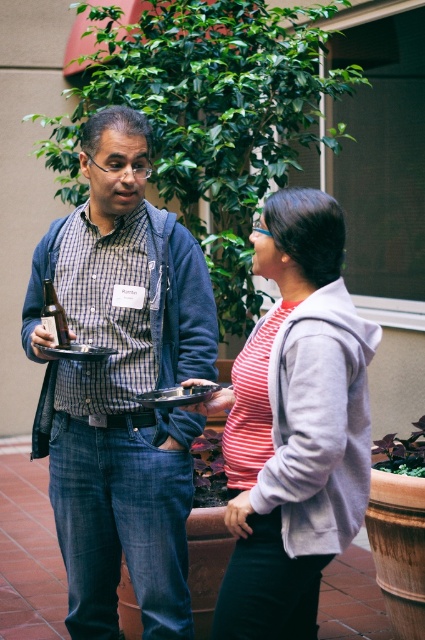
Question: Which point appears farthest from the camera in this image?

Choices:
 (A) (81, 145)
 (B) (252, 406)

Answer: (A)

Question: Does matte blue jeans at center lie in front of striped cotton shirt at center?

Choices:
 (A) no
 (B) yes

Answer: (A)

Question: From the image, what is the correct spatial relationship of matte blue jeans at center in relation to striped cotton shirt at center?

Choices:
 (A) above
 (B) below

Answer: (A)

Question: Does matte blue jeans at center have a larger size compared to striped cotton shirt at center?

Choices:
 (A) yes
 (B) no

Answer: (A)

Question: Which of the following is the farthest from the observer?

Choices:
 (A) coord(329,289)
 (B) coord(136,170)

Answer: (B)